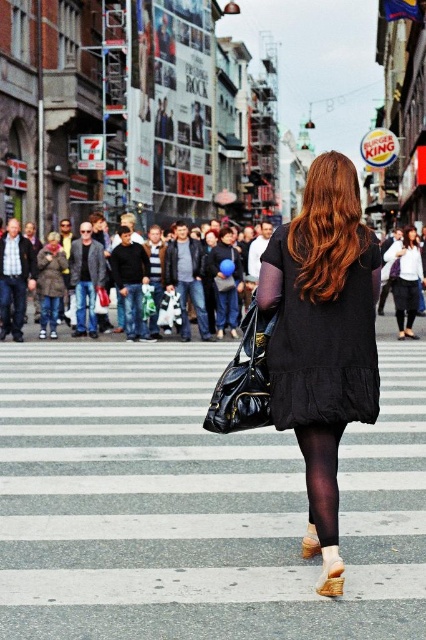
In the scene shown: You are a photographer trying to capture the woman in the black matte dress at center. Based on the coordinates provided, where should you position your camera to ensure the dress is centered in your shot?

The black matte dress at center is located at point coordinates (322,328), so you should position your camera to aim directly at those coordinates to center the dress in your shot.

You are a fashion designer observing the scene and want to create a new outfit. Based on the black matte dress at center and shiny auburn hair at center, which item would you focus on adjusting in terms of width to make them visually balanced?

The black matte dress at center has a narrower width compared to the shiny auburn hair at center. To achieve visual balance, you could widen the black matte dress at center or narrow the shiny auburn hair at center.